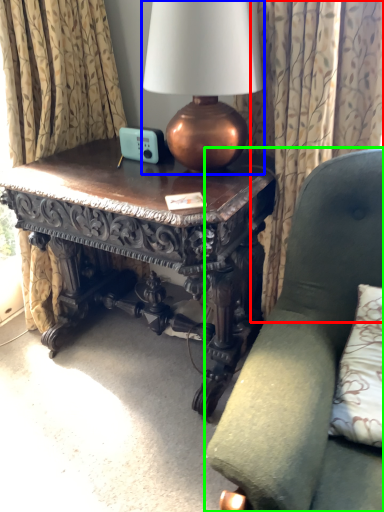
Question: Estimate the real-world distances between objects in this image. Which object is farther from curtain (highlighted by a red box), lamp (highlighted by a blue box) or chair (highlighted by a green box)?

Choices:
 (A) lamp
 (B) chair

Answer: (B)